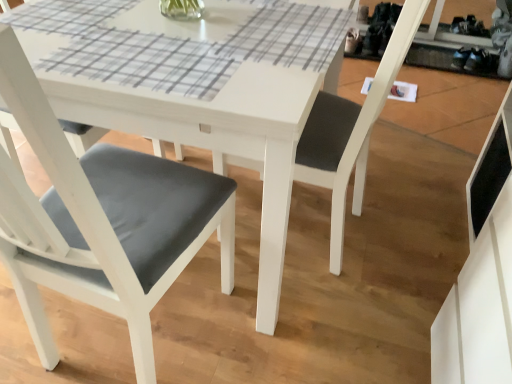
This screenshot has width=512, height=384. In order to click on vacant space situated above matte gray cushion at lower left, which appears as the 2th chair when viewed from the right (from a real-world perspective) in this screenshot , I will do `click(167, 34)`.